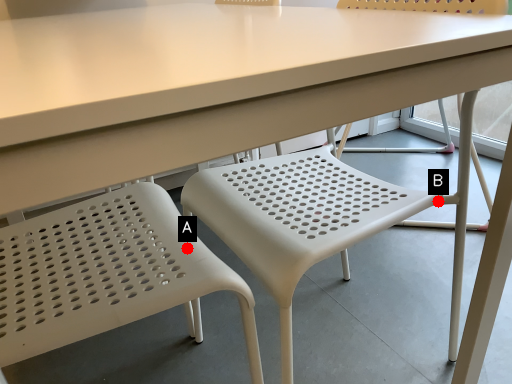
Question: Two points are circled on the image, labeled by A and B beside each circle. Which of the following is the farthest from the observer?

Choices:
 (A) A is further
 (B) B is further

Answer: (B)